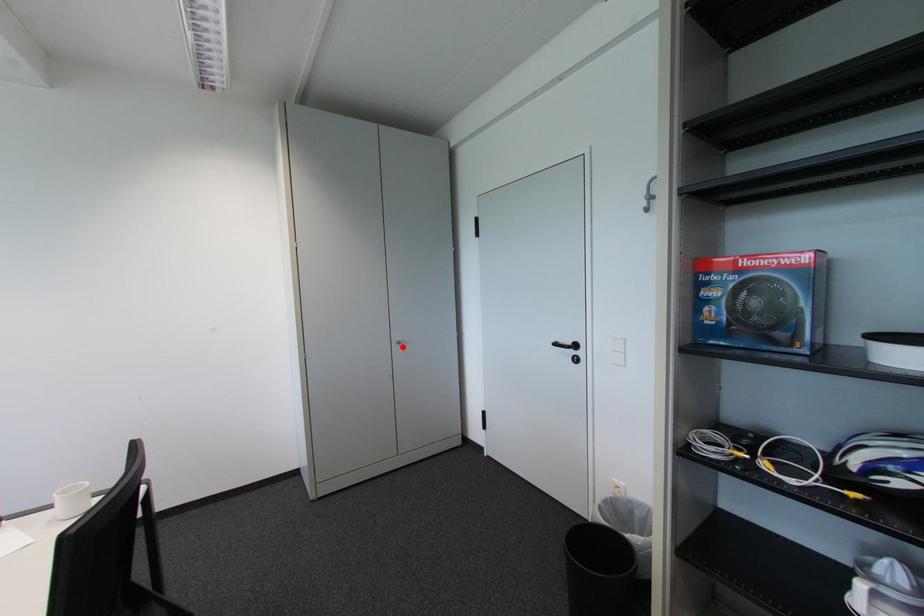
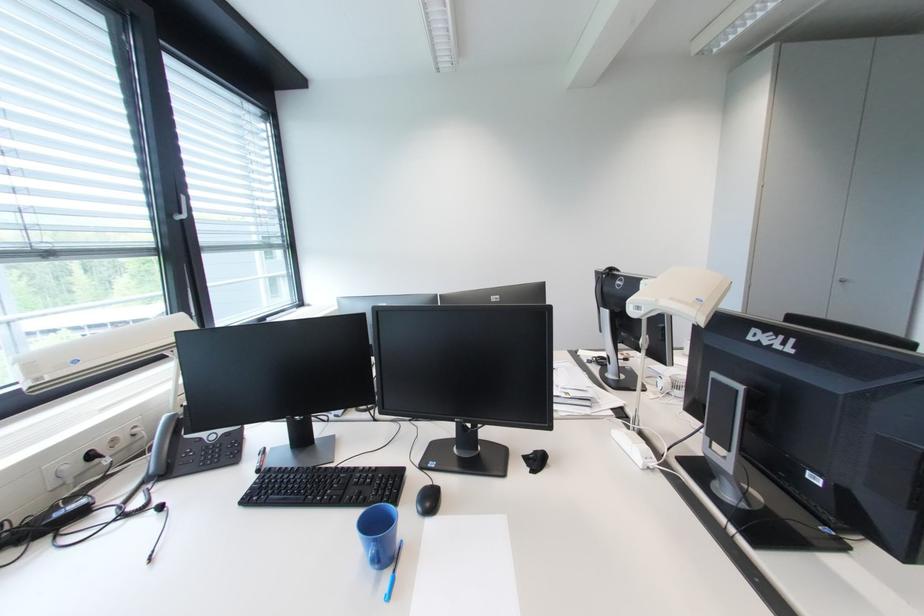
Find the pixel in the second image that matches the highlighted location in the first image.

(844, 285)